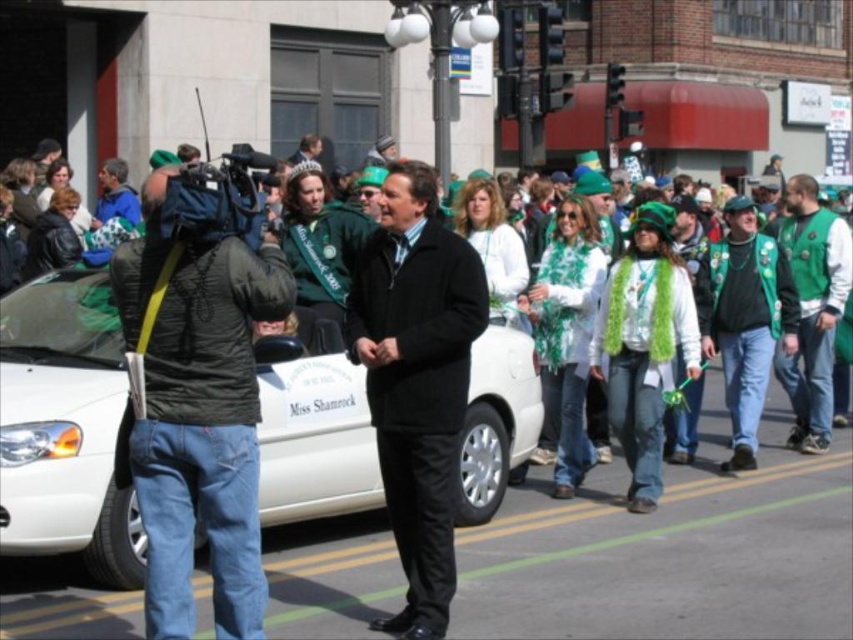
Question: Is white glossy car at center wider than dark green jacket at left?

Choices:
 (A) no
 (B) yes

Answer: (B)

Question: Does dark green jacket at left appear over black matte suit at center?

Choices:
 (A) no
 (B) yes

Answer: (B)

Question: Among these points, which one is farthest from the camera?

Choices:
 (A) (379, 289)
 (B) (811, 285)
 (C) (26, 499)

Answer: (B)

Question: Estimate the real-world distances between objects in this image. Which object is farther from the black matte suit at center?

Choices:
 (A) green textured vest at right
 (B) dark green jacket at left

Answer: (A)

Question: Can you confirm if black matte suit at center is wider than green textured vest at right?

Choices:
 (A) yes
 (B) no

Answer: (B)

Question: Which of the following is the closest to the observer?

Choices:
 (A) black matte suit at center
 (B) green textured vest at right
 (C) dark green jacket at left
 (D) white glossy car at center

Answer: (C)